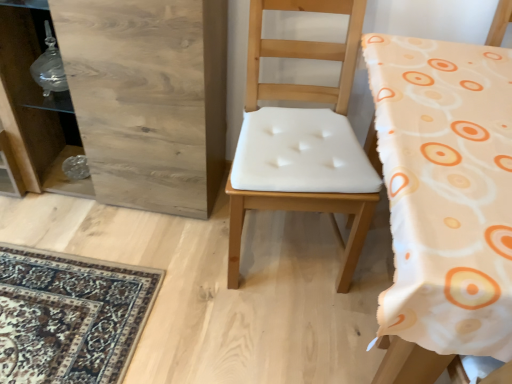
I want to click on wooden dresser at left, so click(123, 100).

Locate an element on the screen. This screenshot has width=512, height=384. wooden dresser at left is located at coordinates (123, 100).

Is white fabric chair at center, which is the 2th chair in left-to-right order, surrounding wooden dresser at left?

Definitely not — wooden dresser at left is not inside white fabric chair at center, which is the 2th chair in left-to-right order.

Considering the sizes of white fabric chair at center, which is the 2th chair in left-to-right order, and wooden dresser at left in the image, is white fabric chair at center, which is the 2th chair in left-to-right order, taller or shorter than wooden dresser at left?

Considering their sizes, white fabric chair at center, which is the 2th chair in left-to-right order, has more height than wooden dresser at left.

Is white fabric chair at center, the 1th chair viewed from the right, not near wooden dresser at left?

white fabric chair at center, the 1th chair viewed from the right, is positioned a significant distance from wooden dresser at left.

Is white fabric chair at center, which ranks as the first chair in left-to-right order, taller than wooden dresser at left?

Yes.

Based on the photo, does white fabric chair at center, arranged as the second chair when viewed from the right, turn towards wooden dresser at left?

No, white fabric chair at center, arranged as the second chair when viewed from the right, is not turned towards wooden dresser at left.

Between white fabric chair at center, arranged as the second chair when viewed from the right, and wooden dresser at left, which one has larger width?

white fabric chair at center, arranged as the second chair when viewed from the right.

Is white fabric chair at center, arranged as the second chair when viewed from the right, situated inside wooden dresser at left or outside?

The correct answer is: outside.

How much distance is there between wooden dresser at left and white fabric chair at center, which is the 2th chair in left-to-right order?

1.16 meters.

Is wooden dresser at left not close to white fabric chair at center, which is the 2th chair in left-to-right order?

Indeed, wooden dresser at left is not near white fabric chair at center, which is the 2th chair in left-to-right order.

Which is more to the left, wooden dresser at left or white fabric chair at center, which is the 2th chair in left-to-right order?

Positioned to the left is wooden dresser at left.

At what (x,y) coordinates should I click in order to perform the action: click on the 2nd chair counting from the right side of the wooden dresser at left. Please return your answer as a coordinate pair (x, y). The image size is (512, 384). Looking at the image, I should click on (411, 364).

Can you tell me how much white fabric chair at center, which ranks as the first chair in left-to-right order, and white fabric chair at center, which is the 2th chair in left-to-right order, differ in facing direction?

white fabric chair at center, which ranks as the first chair in left-to-right order, and white fabric chair at center, which is the 2th chair in left-to-right order, are facing 174 degrees away from each other.

In the image, there is a white fabric chair at center, which ranks as the first chair in left-to-right order. At what (x,y) coordinates should I click in order to perform the action: click on chair below it (from the image's perspective). Please return your answer as a coordinate pair (x, y). The height and width of the screenshot is (384, 512). Looking at the image, I should click on [x=411, y=364].

Considering the positions of objects white fabric chair at center, arranged as the second chair when viewed from the right, and white fabric chair at center, which is the 2th chair in left-to-right order, in the image provided, who is more to the left, white fabric chair at center, arranged as the second chair when viewed from the right, or white fabric chair at center, which is the 2th chair in left-to-right order,?

From the viewer's perspective, white fabric chair at center, arranged as the second chair when viewed from the right, appears more on the left side.

Is white fabric chair at center, arranged as the second chair when viewed from the right, looking in the opposite direction of white fabric chair at center, which is the 2th chair in left-to-right order?

That's not correct — white fabric chair at center, arranged as the second chair when viewed from the right, is not looking away from white fabric chair at center, which is the 2th chair in left-to-right order.

Between wooden dresser at left and white fabric chair at center, which ranks as the first chair in left-to-right order, which one appears on the right side from the viewer's perspective?

Positioned to the right is white fabric chair at center, which ranks as the first chair in left-to-right order.

From the picture: Is wooden dresser at left far from white fabric chair at center, arranged as the second chair when viewed from the right?

Actually, wooden dresser at left and white fabric chair at center, arranged as the second chair when viewed from the right, are a little close together.

From the image's perspective, which is above, wooden dresser at left or white fabric chair at center, which ranks as the first chair in left-to-right order?

wooden dresser at left is shown above in the image.

Is white fabric chair at center, the 1th chair viewed from the right, beside white fabric chair at center, which ranks as the first chair in left-to-right order?

No, white fabric chair at center, the 1th chair viewed from the right, is not with white fabric chair at center, which ranks as the first chair in left-to-right order.

Is white fabric chair at center, the 1th chair viewed from the right, taller or shorter than white fabric chair at center, which ranks as the first chair in left-to-right order?

white fabric chair at center, the 1th chair viewed from the right, is taller than white fabric chair at center, which ranks as the first chair in left-to-right order.

Choose the correct answer: Is white fabric chair at center, which is the 2th chair in left-to-right order, inside white fabric chair at center, arranged as the second chair when viewed from the right, or outside it?

white fabric chair at center, which is the 2th chair in left-to-right order, is not inside white fabric chair at center, arranged as the second chair when viewed from the right, it's outside.

At what (x,y) coordinates should I click in order to perform the action: click on dresser above the white fabric chair at center, which is the 2th chair in left-to-right order (from the image's perspective). Please return your answer as a coordinate pair (x, y). The image size is (512, 384). Looking at the image, I should click on (123, 100).

Identify the location of dresser that appears behind the white fabric chair at center, arranged as the second chair when viewed from the right. (123, 100).

Considering their positions, is white fabric chair at center, which is the 2th chair in left-to-right order, positioned further to white fabric chair at center, which ranks as the first chair in left-to-right order, than wooden dresser at left?

white fabric chair at center, which is the 2th chair in left-to-right order, lies further to white fabric chair at center, which ranks as the first chair in left-to-right order, than the other object.

Based on their spatial positions, is wooden dresser at left or white fabric chair at center, the 1th chair viewed from the right, closer to white fabric chair at center, arranged as the second chair when viewed from the right?

wooden dresser at left.

Estimate the real-world distances between objects in this image. Which object is further from wooden dresser at left, white fabric chair at center, the 1th chair viewed from the right, or white fabric chair at center, arranged as the second chair when viewed from the right?

white fabric chair at center, the 1th chair viewed from the right, is positioned further to the anchor wooden dresser at left.

Estimate the real-world distances between objects in this image. Which object is closer to white fabric chair at center, which is the 2th chair in left-to-right order, white fabric chair at center, arranged as the second chair when viewed from the right, or wooden dresser at left?

white fabric chair at center, arranged as the second chair when viewed from the right, lies closer to white fabric chair at center, which is the 2th chair in left-to-right order, than the other object.

Consider the image. Estimate the real-world distances between objects in this image. Which object is further from wooden dresser at left, white fabric chair at center, which ranks as the first chair in left-to-right order, or white fabric chair at center, which is the 2th chair in left-to-right order?

white fabric chair at center, which is the 2th chair in left-to-right order, is further to wooden dresser at left.

Estimate the real-world distances between objects in this image. Which object is closer to white fabric chair at center, which is the 2th chair in left-to-right order, wooden dresser at left or white fabric chair at center, which ranks as the first chair in left-to-right order?

The object closer to white fabric chair at center, which is the 2th chair in left-to-right order, is white fabric chair at center, which ranks as the first chair in left-to-right order.

What are the coordinates of `chair situated between wooden dresser at left and white fabric chair at center, the 1th chair viewed from the right, from left to right` in the screenshot? It's located at (303, 54).